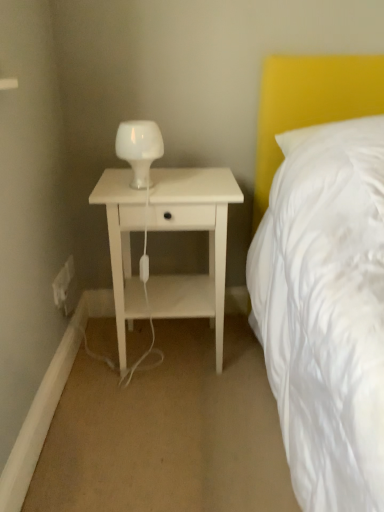
Question: From the image's perspective, is white glass lamp at center above or below white matte nightstand at center?

Choices:
 (A) below
 (B) above

Answer: (B)

Question: Is white glass lamp at center to the left or to the right of white matte nightstand at center in the image?

Choices:
 (A) left
 (B) right

Answer: (A)

Question: Estimate the real-world distances between objects in this image. Which object is closer to the white matte nightstand at center?

Choices:
 (A) white plastic electric outlet at lower left, arranged as the 2th electric outlet when viewed from the front
 (B) white glass lamp at center
 (C) white plastic electric outlet at lower left, arranged as the second electric outlet when viewed from the back

Answer: (B)

Question: Which of these objects is positioned closest to the white plastic electric outlet at lower left, arranged as the second electric outlet when viewed from the back?

Choices:
 (A) white matte nightstand at center
 (B) white glass lamp at center
 (C) white plastic electric outlet at lower left, arranged as the 2th electric outlet when viewed from the front

Answer: (C)